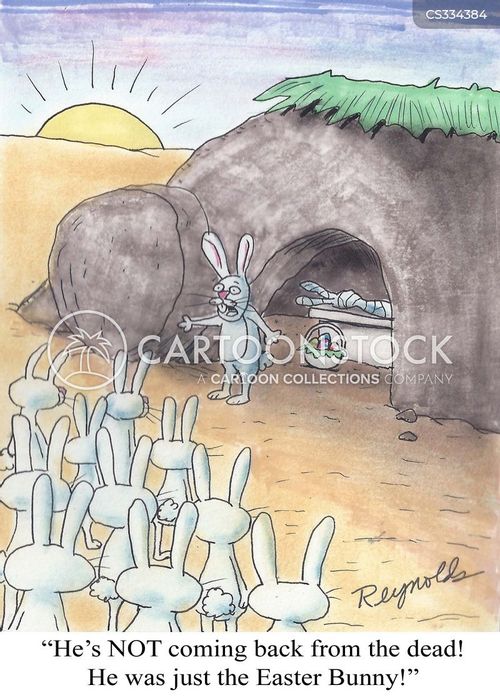
The width and height of the screenshot is (500, 700). Find the location of `basket handle`. basket handle is located at coordinates (327, 323).